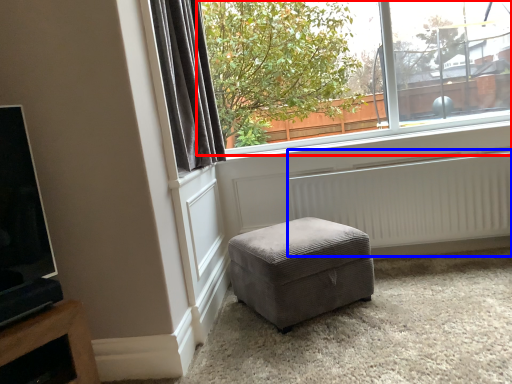
Question: Which object appears farthest to the camera in this image, window (highlighted by a red box) or radiator (highlighted by a blue box)?

Choices:
 (A) window
 (B) radiator

Answer: (A)